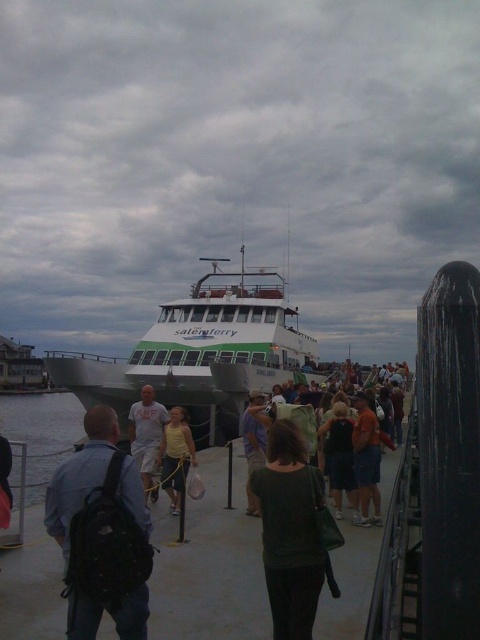
Question: Does green matte ferry at center have a greater width compared to matte black backpack at center?

Choices:
 (A) no
 (B) yes

Answer: (B)

Question: Which point is closer to the camera?

Choices:
 (A) (275, 456)
 (B) (180, 435)

Answer: (A)

Question: Among these objects, which one is nearest to the camera?

Choices:
 (A) green matte ferry at center
 (B) clear water at lower left

Answer: (B)

Question: Considering the relative positions of light gray cotton shirt at center and yellow cotton shirt at center in the image provided, where is light gray cotton shirt at center located with respect to yellow cotton shirt at center?

Choices:
 (A) right
 (B) left

Answer: (B)

Question: Which point is farther to the camera?

Choices:
 (A) (177, 452)
 (B) (230, 413)
 (C) (308, 522)

Answer: (B)

Question: Does matte black backpack at center come behind yellow cotton shirt at center?

Choices:
 (A) no
 (B) yes

Answer: (A)